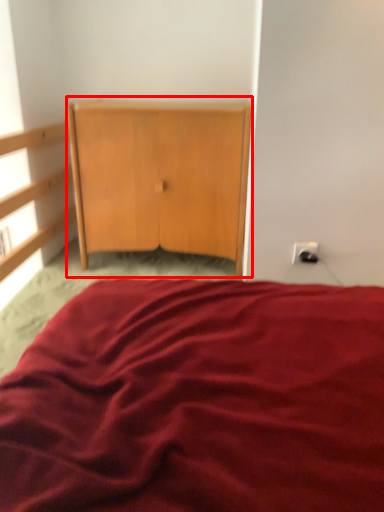
Question: In this image, where is cupboard (annotated by the red box) located relative to electric outlet?

Choices:
 (A) right
 (B) left

Answer: (B)